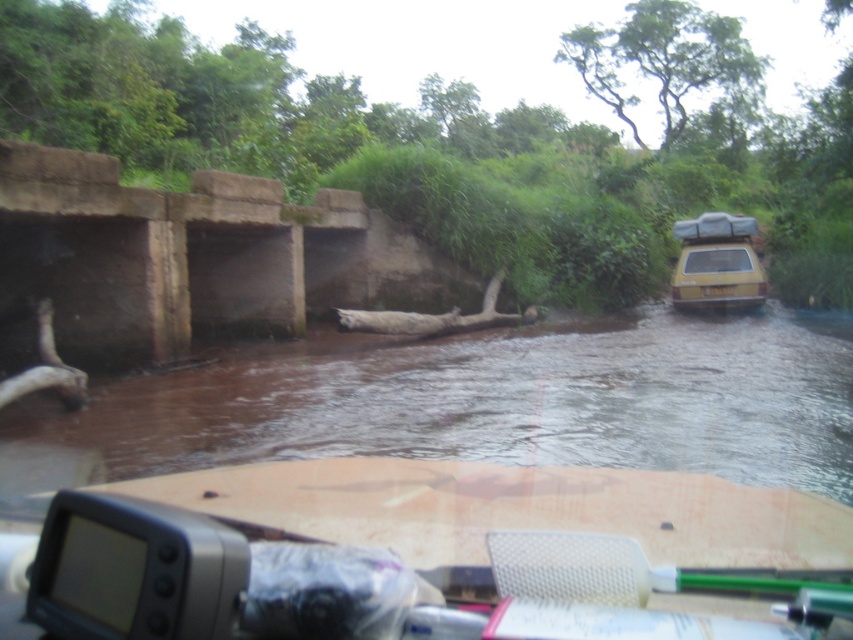
Can you confirm if brown muddy water at center is positioned to the right of yellow matte car at right?

In fact, brown muddy water at center is to the left of yellow matte car at right.

Which is below, brown muddy water at center or yellow matte car at right?

Positioned lower is brown muddy water at center.

This screenshot has height=640, width=853. Describe the element at coordinates (498, 401) in the screenshot. I see `brown muddy water at center` at that location.

Locate an element on the screen. Image resolution: width=853 pixels, height=640 pixels. brown muddy water at center is located at coordinates (498, 401).